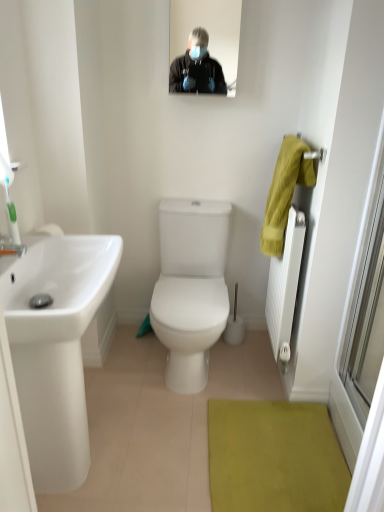
Question: Is white textured radiator at right behind white glossy toilet at center?

Choices:
 (A) yes
 (B) no

Answer: (B)

Question: Is white textured radiator at right at the right side of white glossy toilet at center?

Choices:
 (A) no
 (B) yes

Answer: (B)

Question: Does white textured radiator at right have a greater height compared to white glossy toilet at center?

Choices:
 (A) no
 (B) yes

Answer: (B)

Question: Is white textured radiator at right closer to the viewer compared to white glossy toilet at center?

Choices:
 (A) no
 (B) yes

Answer: (B)

Question: From a real-world perspective, is white textured radiator at right on top of white glossy toilet at center?

Choices:
 (A) no
 (B) yes

Answer: (B)

Question: Is white textured radiator at right far away from white glossy toilet at center?

Choices:
 (A) no
 (B) yes

Answer: (A)

Question: Can you confirm if yellow fabric hand towel at right is positioned to the left of white glossy toilet at center?

Choices:
 (A) no
 (B) yes

Answer: (A)

Question: Is yellow fabric hand towel at right positioned behind white glossy toilet at center?

Choices:
 (A) no
 (B) yes

Answer: (A)

Question: Is yellow fabric hand towel at right in contact with white glossy toilet at center?

Choices:
 (A) yes
 (B) no

Answer: (B)

Question: Is yellow fabric hand towel at right positioned before white glossy toilet at center?

Choices:
 (A) yes
 (B) no

Answer: (A)

Question: Does yellow fabric hand towel at right have a lesser height compared to white glossy toilet at center?

Choices:
 (A) no
 (B) yes

Answer: (B)

Question: From a real-world perspective, is yellow fabric hand towel at right under white glossy toilet at center?

Choices:
 (A) yes
 (B) no

Answer: (B)

Question: Can you confirm if transparent glass door at right is thinner than matte black mirror at upper center?

Choices:
 (A) no
 (B) yes

Answer: (B)